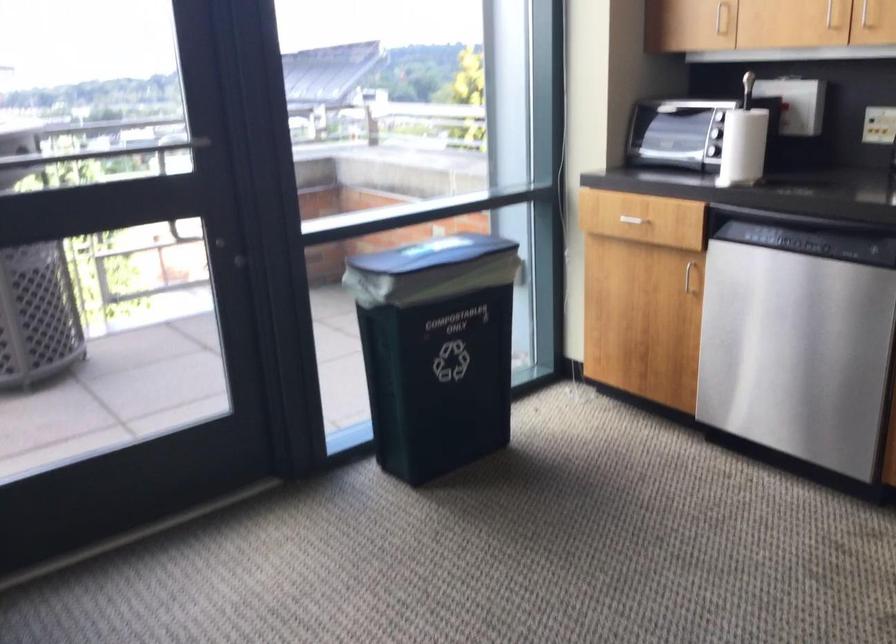
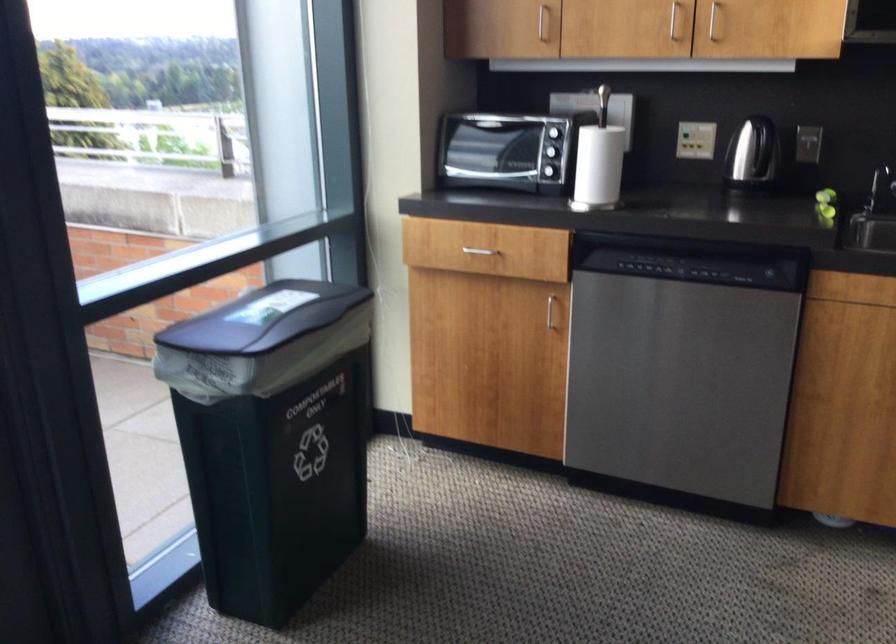
Where in the second image is the point corresponding to (745,146) from the first image?

(599, 165)